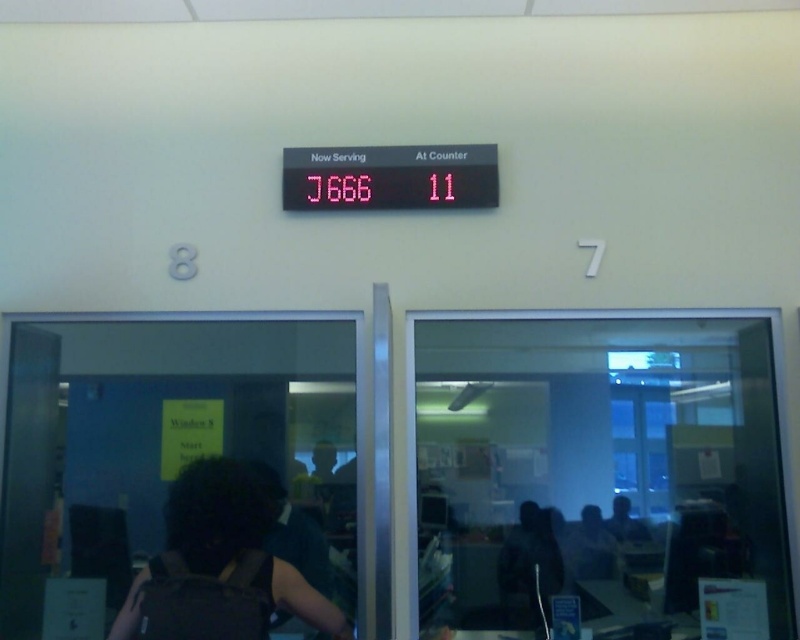
Is dark brown backpack at lower left closer to camera compared to red led sign at center?

Yes.

Is dark brown backpack at lower left further to camera compared to red led sign at center?

No, dark brown backpack at lower left is in front of red led sign at center.

Identify the location of dark brown backpack at lower left. (216, 515).

Is transparent glass door at right positioned in front of red led sign at center?

Yes, it is.

Looking at this image, between transparent glass door at right and red led sign at center, which one appears on the right side from the viewer's perspective?

From the viewer's perspective, transparent glass door at right appears more on the right side.

Who is more distant from viewer, [428,346] or [424,154]?

Point [424,154]

Find the location of `transparent glass door at right`. transparent glass door at right is located at coordinates (598, 474).

Looking at this image, is transparent glass door at lower left to the right of red led sign at center from the viewer's perspective?

In fact, transparent glass door at lower left is to the left of red led sign at center.

Does transparent glass door at lower left have a lesser width compared to red led sign at center?

In fact, transparent glass door at lower left might be wider than red led sign at center.

Is point (192, 566) positioned in front of point (468, 204)?

Yes, it is.

The width and height of the screenshot is (800, 640). What are the coordinates of `transparent glass door at lower left` in the screenshot? It's located at (x=180, y=467).